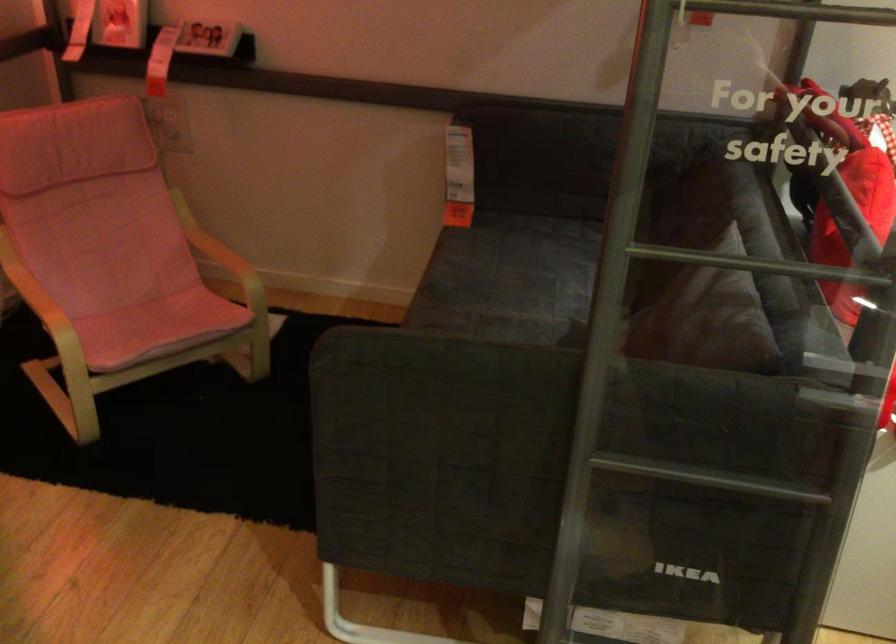
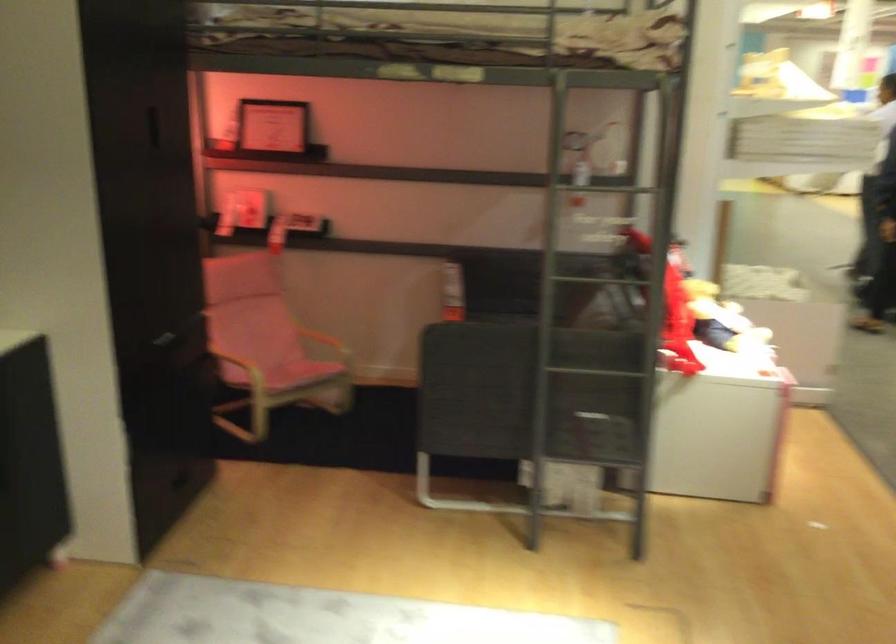
Find the pixel in the second image that matches pixel 259 227 in the first image.

(332, 328)